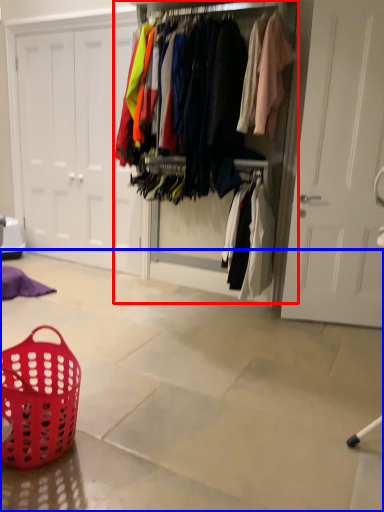
Question: Which object appears farthest to the camera in this image, closet (highlighted by a red box) or concrete (highlighted by a blue box)?

Choices:
 (A) closet
 (B) concrete

Answer: (A)